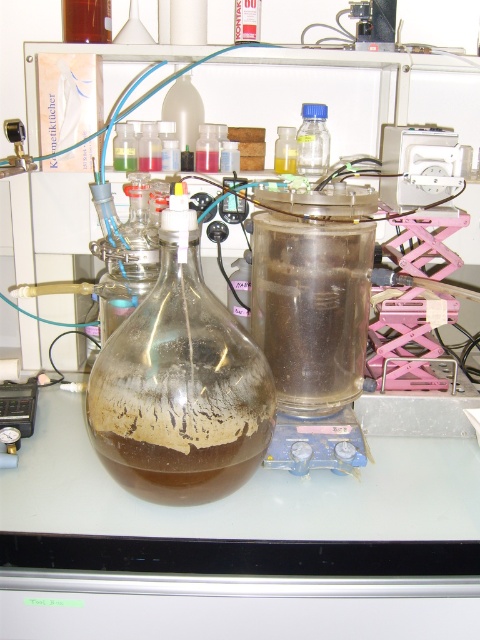
Question: Which point is farther to the camera?

Choices:
 (A) transparent plastic bottle at upper right
 (B) transparent glass bottle at center
 (C) translucent plastic test tube at center

Answer: (B)

Question: Does transparent plastic test tube at upper center appear over translucent plastic test tube at center?

Choices:
 (A) no
 (B) yes

Answer: (B)

Question: Estimate the real-world distances between objects in this image. Which object is farther from the transparent plastic bottle at upper center?

Choices:
 (A) transparent plastic bottle at upper right
 (B) transparent plastic test tube at upper center
 (C) translucent plastic test tube at upper center

Answer: (C)

Question: Among these points, which one is farthest from the camera?

Choices:
 (A) (285, 172)
 (B) (302, 132)
 (C) (130, 157)

Answer: (B)

Question: Does translucent plastic test tube at center have a smaller size compared to transparent plastic bottle at upper center?

Choices:
 (A) no
 (B) yes

Answer: (B)

Question: Is transparent plastic bottle at upper right below transparent plastic bottle at upper center?

Choices:
 (A) no
 (B) yes

Answer: (A)